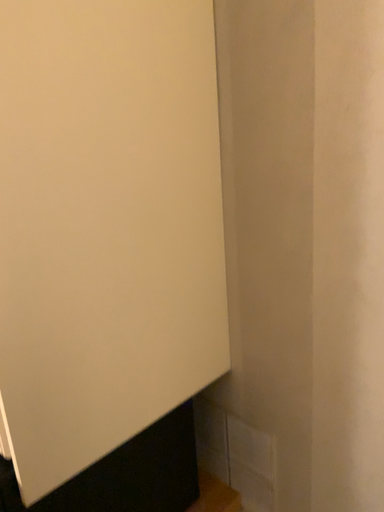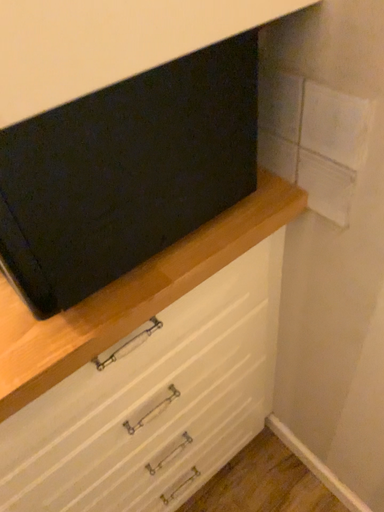
Question: Which way did the camera rotate in the video?

Choices:
 (A) rotated right
 (B) rotated left

Answer: (B)